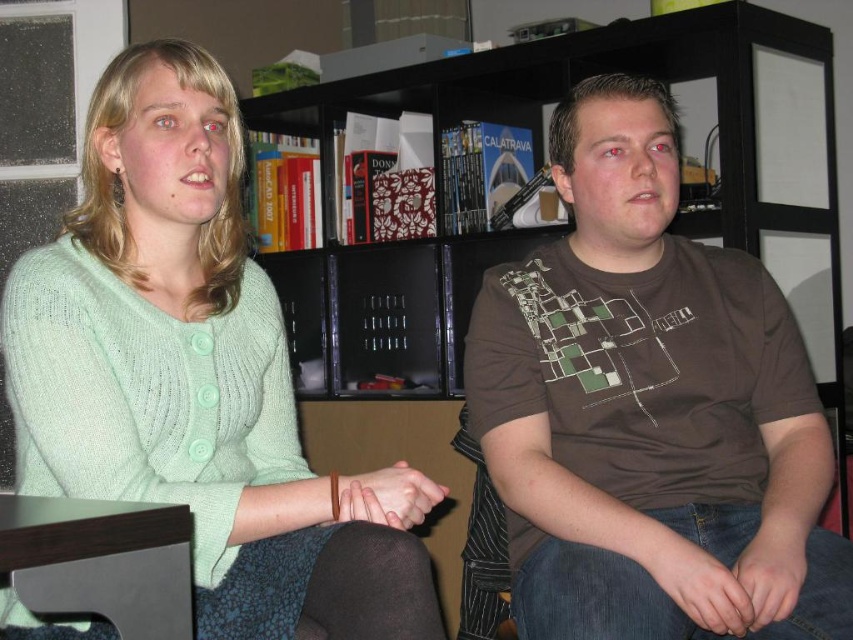
You are organizing a clothing donation drive and need to determine if the green knitted sweater at upper left can fit into a box designed for smaller items. The box can only accommodate items smaller than the jeans at lower right. Can the sweater fit?

The green knitted sweater at upper left is larger in size than the jeans at lower right. Since the box is for items smaller than the jeans, the sweater cannot fit into the box.

You are trying to decide whether to place a new book horizontally on the black matte bookshelf at upper center or vertically on the jeans at lower right. Which surface can definitely accommodate the book without it hanging off the edge?

The black matte bookshelf at upper center is wider than the jeans at lower right, so placing the book horizontally on the black matte bookshelf at upper center would definitely accommodate it without hanging off the edge.